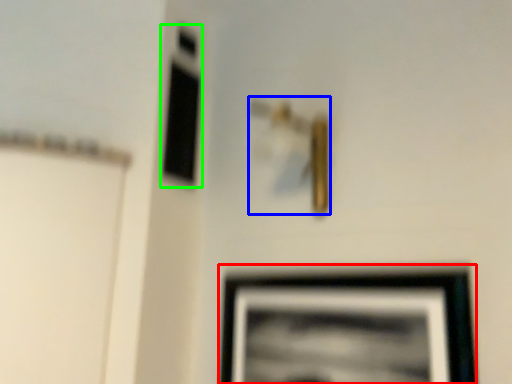
Question: Which object is the farthest from picture frame (highlighted by a red box)? Choose among these: door handle (highlighted by a blue box) or window (highlighted by a green box).

Choices:
 (A) door handle
 (B) window

Answer: (B)